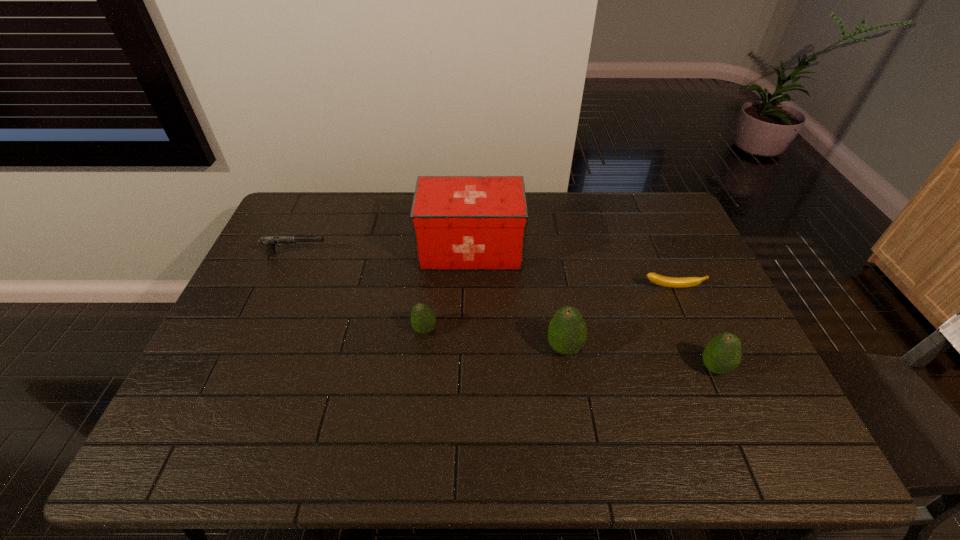
In order to click on avocado that is positioned at the right edge in this screenshot , I will do tap(722, 355).

The height and width of the screenshot is (540, 960). What are the coordinates of `banana situated at the right edge` in the screenshot? It's located at (660, 280).

Locate an element on the screen. Image resolution: width=960 pixels, height=540 pixels. object located in the near right corner section of the desktop is located at coordinates (722, 355).

Where is `vacant region at the far edge of the desktop`? This screenshot has height=540, width=960. vacant region at the far edge of the desktop is located at coordinates (594, 207).

Identify the location of vacant space at the near edge. The image size is (960, 540). (489, 411).

This screenshot has width=960, height=540. Identify the location of vacant space at the left edge. (255, 370).

Locate an element on the screen. The height and width of the screenshot is (540, 960). vacant space at the far left corner of the desktop is located at coordinates (319, 215).

Identify the location of free spot at the near right corner of the desktop. (748, 387).

This screenshot has width=960, height=540. I want to click on free space between the shortest avocado and the fifth tallest object, so click(360, 292).

Locate an element on the screen. This screenshot has height=540, width=960. empty space between the second avocado from left to right and the third tallest object is located at coordinates (639, 358).